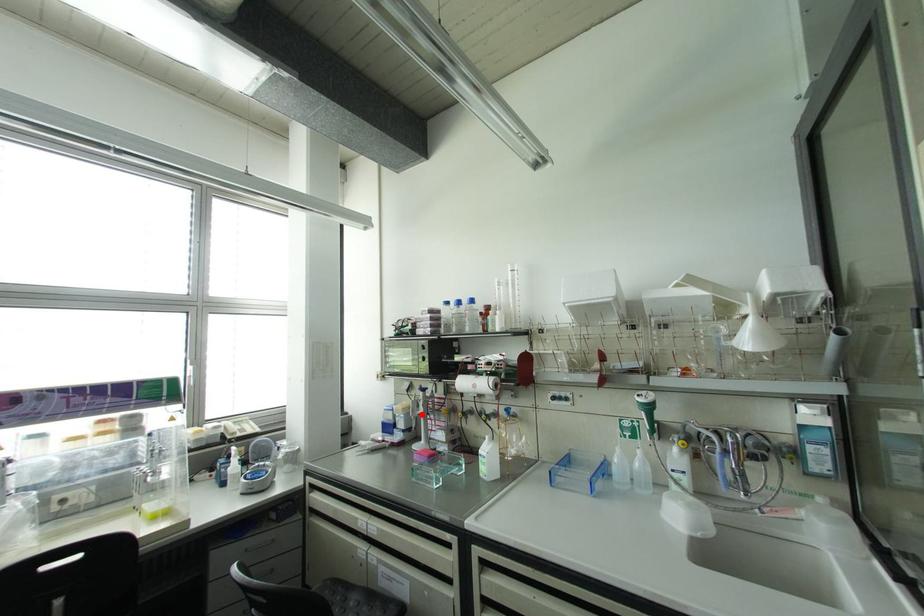
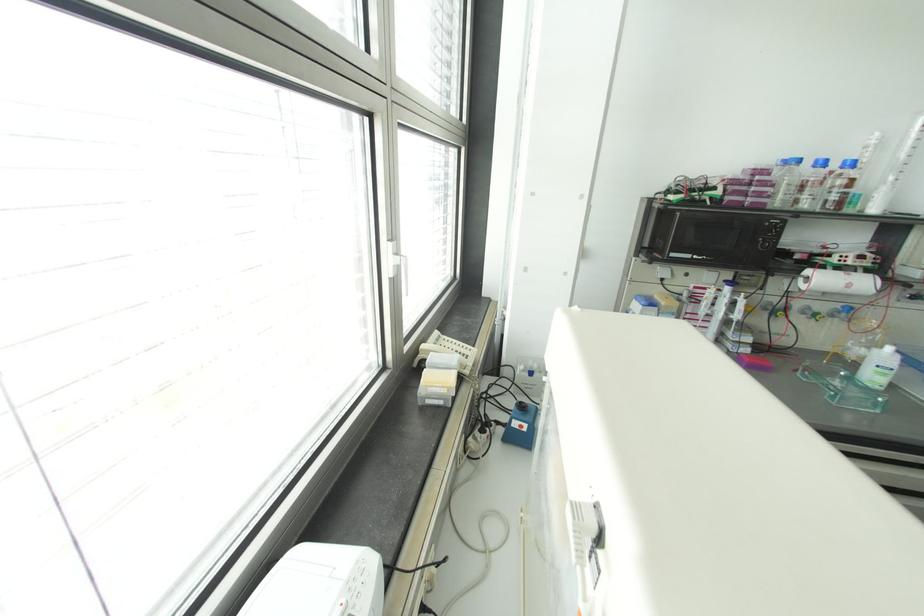
Find the pixel in the second image that matches the highlighted location in the first image.

(736, 315)